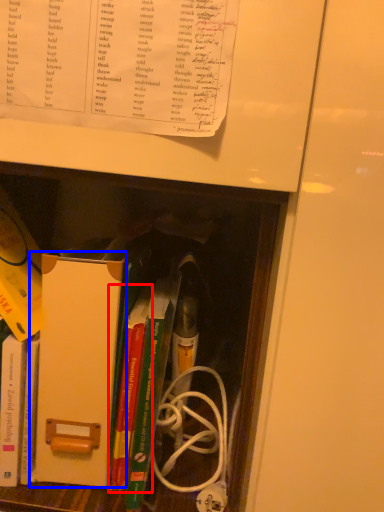
Question: Which object is closer to the camera taking this photo, book (highlighted by a red box) or paperback book (highlighted by a blue box)?

Choices:
 (A) book
 (B) paperback book

Answer: (B)